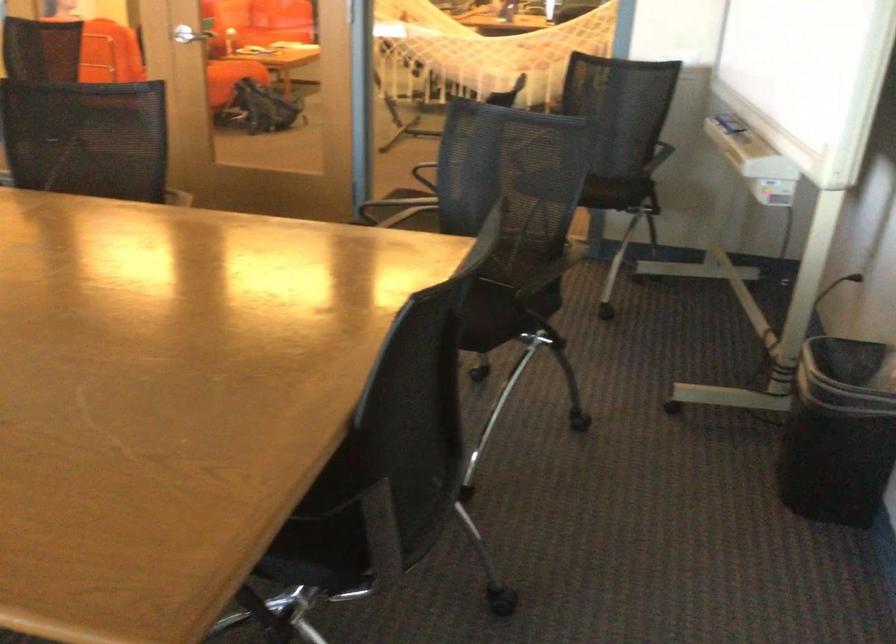
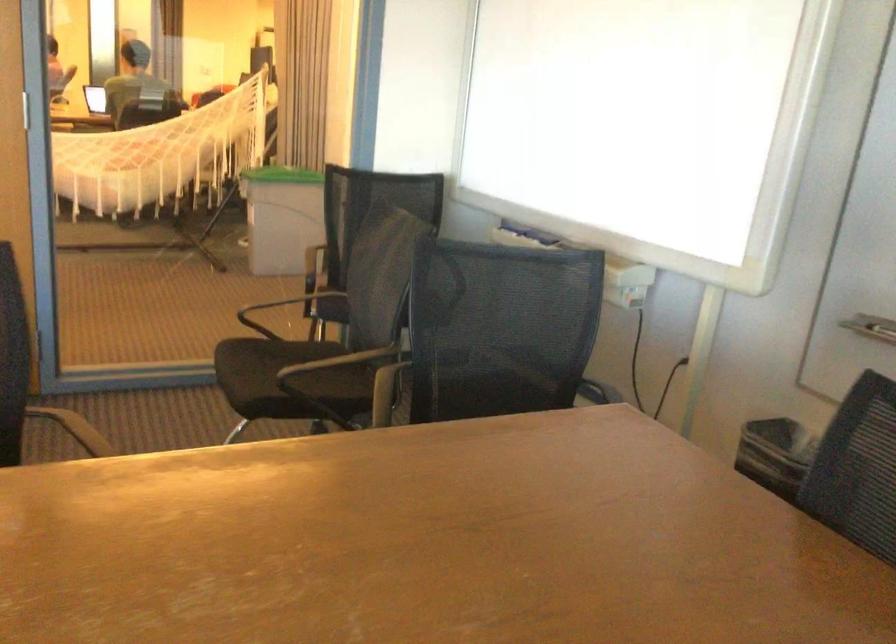
Locate, in the second image, the point that corresponds to point (407, 218) in the first image.

(288, 379)